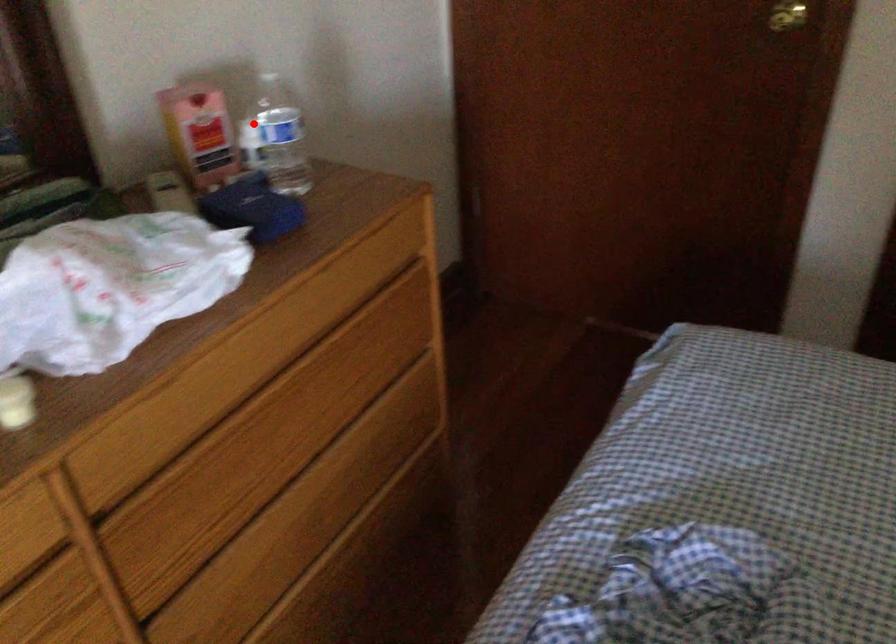
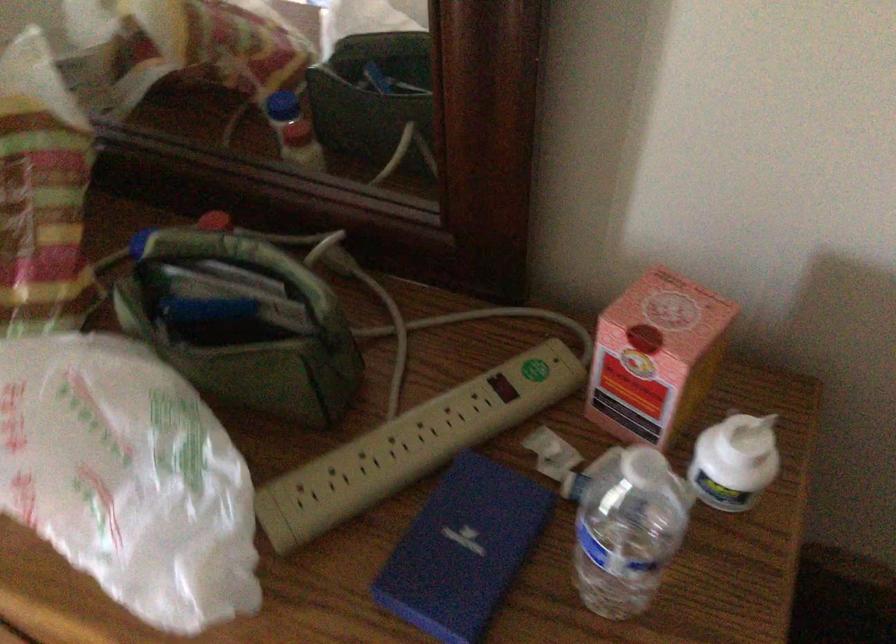
Question: A red point is marked in image1. In image2, is the corresponding 3D point closer to the camera or farther? Reply with the corresponding letter.

Choices:
 (A) The corresponding 3D point is closer.
 (B) The corresponding 3D point is farther.

Answer: (A)